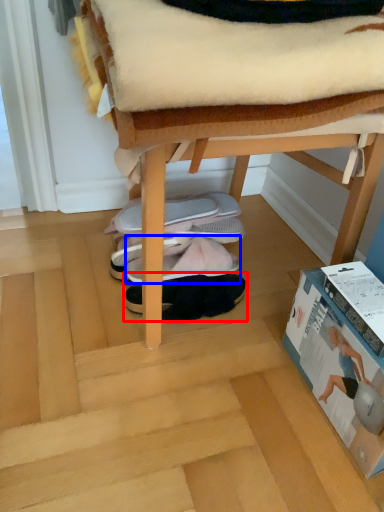
Question: Among these objects, which one is farthest to the camera, footwear (highlighted by a red box) or footwear (highlighted by a blue box)?

Choices:
 (A) footwear
 (B) footwear

Answer: (B)